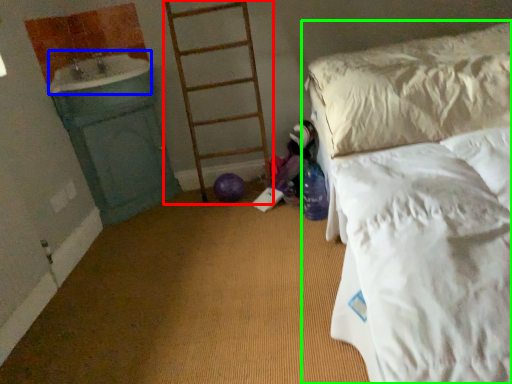
Question: Based on their relative distances, which object is nearer to ladder (highlighted by a red box)? Choose from sink (highlighted by a blue box) and bed (highlighted by a green box).

Choices:
 (A) sink
 (B) bed

Answer: (A)